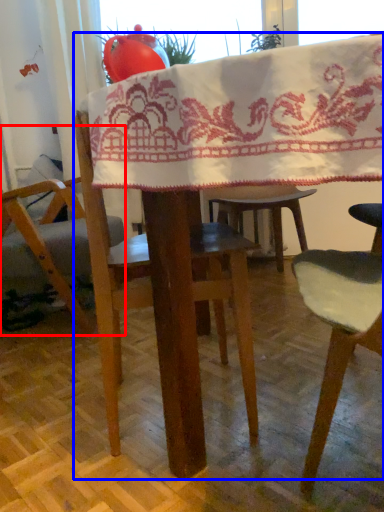
Question: Which of the following is the farthest to the observer, chair (highlighted by a red box) or table (highlighted by a blue box)?

Choices:
 (A) chair
 (B) table

Answer: (A)